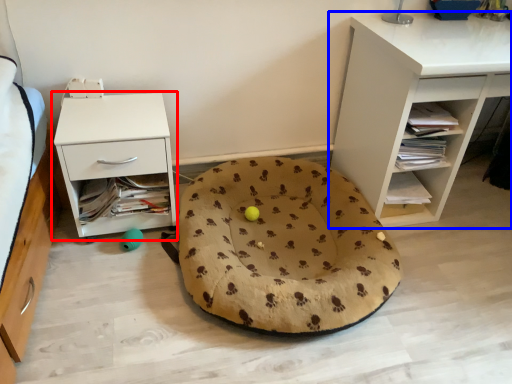
Question: Which object is further to the camera taking this photo, nightstand (highlighted by a red box) or shelf (highlighted by a blue box)?

Choices:
 (A) nightstand
 (B) shelf

Answer: (A)